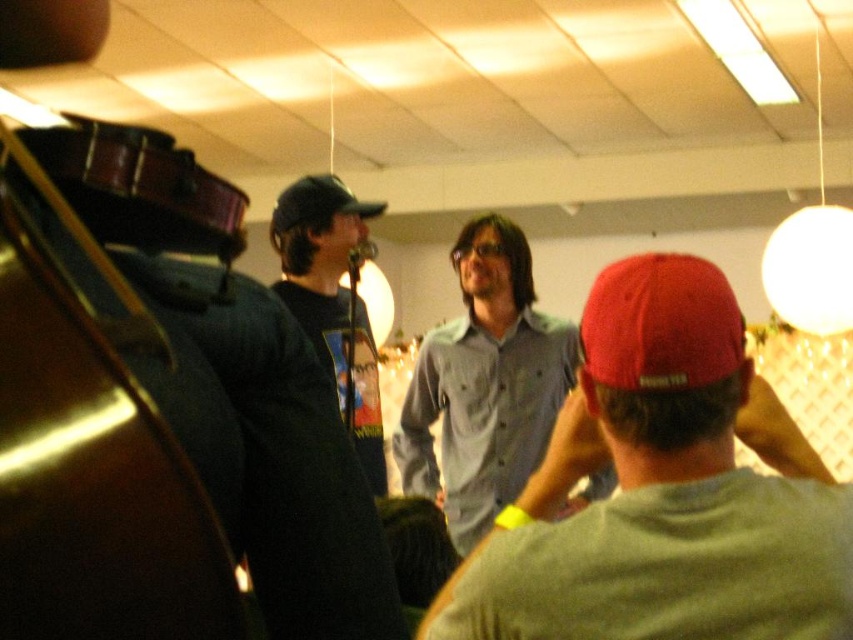
Is the position of gray button-up shirt at center more distant than that of black matte baseball cap at upper center?

No, it is in front of black matte baseball cap at upper center.

Can you confirm if gray button-up shirt at center is taller than black matte baseball cap at upper center?

Correct, gray button-up shirt at center is much taller as black matte baseball cap at upper center.

Find the location of a particular element. This screenshot has width=853, height=640. gray button-up shirt at center is located at coordinates (659, 492).

Where is `gray button-up shirt at center`? gray button-up shirt at center is located at coordinates (659, 492).

Based on the photo, who is more forward, (703, 468) or (515, 410)?

Point (703, 468)

Is point (793, 588) positioned after point (553, 387)?

That is False.

Image resolution: width=853 pixels, height=640 pixels. In order to click on gray button-up shirt at center in this screenshot , I will do `click(659, 492)`.

Between red matte baseball cap at center and black matte t-shirt at center, which one has less height?

red matte baseball cap at center is shorter.

Can you confirm if red matte baseball cap at center is positioned to the right of black matte t-shirt at center?

Indeed, red matte baseball cap at center is positioned on the right side of black matte t-shirt at center.

Locate an element on the screen. The image size is (853, 640). red matte baseball cap at center is located at coordinates (660, 324).

Image resolution: width=853 pixels, height=640 pixels. Identify the location of red matte baseball cap at center. (660, 324).